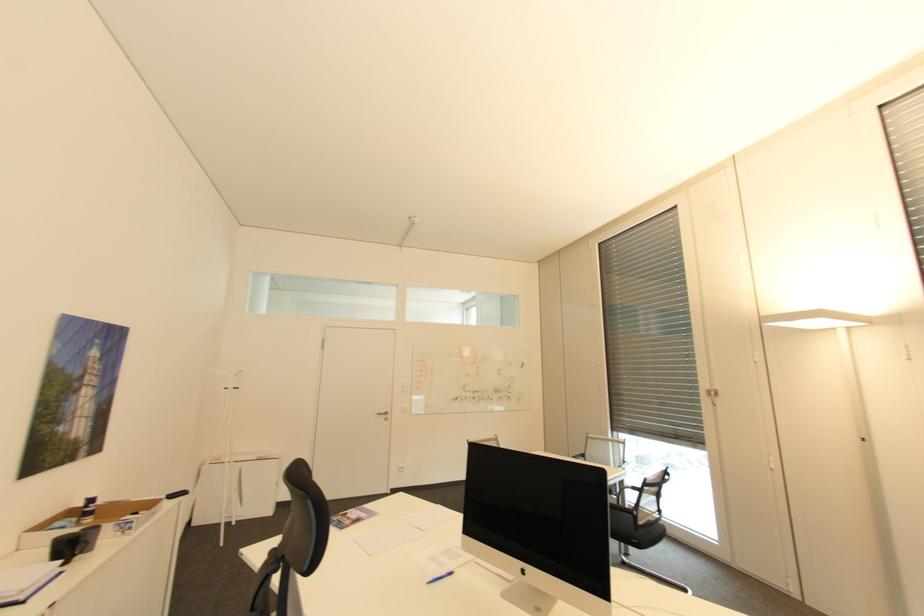
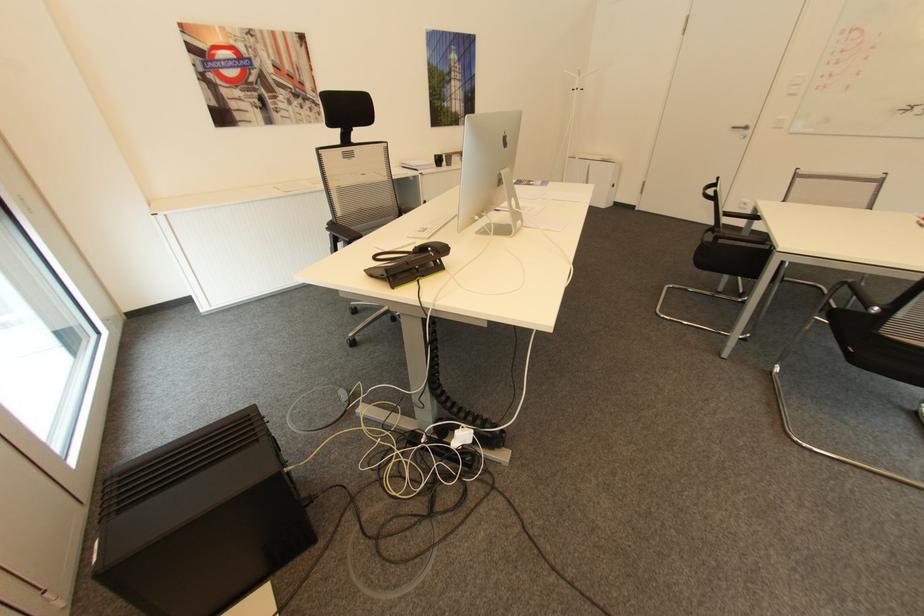
Where in the second image is the point corresponding to [391,413] from the first image?

(749, 128)